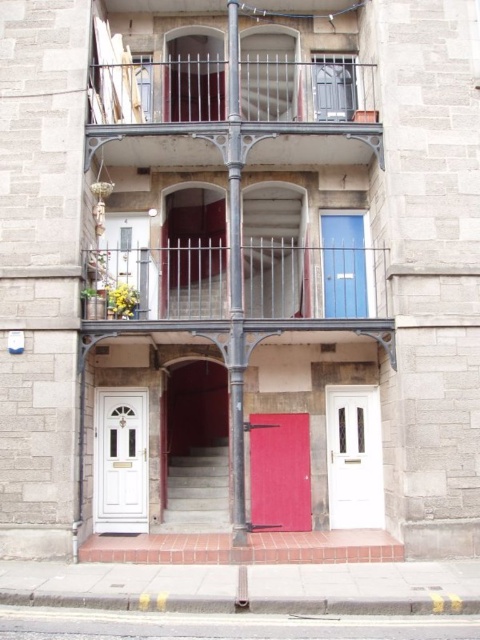
Is metallic wrought iron balcony at upper center to the right of white glossy door at lower left from the viewer's perspective?

Yes, metallic wrought iron balcony at upper center is to the right of white glossy door at lower left.

Based on the photo, who is lower down, metallic wrought iron balcony at upper center or white glossy door at lower left?

white glossy door at lower left

Who is more forward, (x=314, y=124) or (x=117, y=406)?

Point (x=314, y=124) is in front.

Locate an element on the screen. metallic wrought iron balcony at upper center is located at coordinates (232, 99).

Consider the image. Who is shorter, metallic railing at upper center or blue matte door at center?

With less height is metallic railing at upper center.

Can you confirm if metallic railing at upper center is positioned below blue matte door at center?

Yes.

What do you see at coordinates (156, 288) in the screenshot? I see `metallic railing at upper center` at bounding box center [156, 288].

The width and height of the screenshot is (480, 640). In order to click on metallic railing at upper center in this screenshot , I will do `click(156, 288)`.

At what (x,y) coordinates should I click in order to perform the action: click on white glossy door at lower left. Please return your answer as a coordinate pair (x, y). This screenshot has width=480, height=640. Looking at the image, I should click on (120, 461).

Between white glossy door at lower left and white glass door at center, which one appears on the right side from the viewer's perspective?

white glass door at center is more to the right.

Which is behind, point (103, 397) or point (373, 413)?

Point (103, 397)

At what (x,y) coordinates should I click in order to perform the action: click on white glossy door at lower left. Please return your answer as a coordinate pair (x, y). The image size is (480, 640). Looking at the image, I should click on (120, 461).